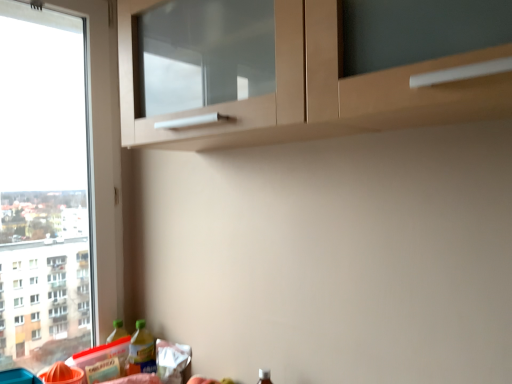
Question: From the image's perspective, is translucent plastic bottle at lower left, which is counted as the first bottle, starting from the left, above or below translucent plastic bottle at lower left, the first bottle when ordered from right to left?

Choices:
 (A) below
 (B) above

Answer: (A)

Question: Is translucent plastic bottle at lower left, the second bottle viewed from the right, taller or shorter than translucent plastic bottle at lower left, the first bottle when ordered from right to left?

Choices:
 (A) short
 (B) tall

Answer: (B)

Question: From a real-world perspective, relative to translucent plastic bottle at lower left, arranged as the 2th bottle when viewed from the left, is translucent plastic bottle at lower left, which is counted as the first bottle, starting from the left, vertically above or below?

Choices:
 (A) above
 (B) below

Answer: (A)

Question: From a real-world perspective, is translucent plastic bottle at lower left, the first bottle when ordered from right to left, physically located above or below translucent plastic bottle at lower left, the second bottle viewed from the right?

Choices:
 (A) above
 (B) below

Answer: (B)

Question: Relative to translucent plastic bottle at lower left, the second bottle viewed from the right, is translucent plastic bottle at lower left, the first bottle when ordered from right to left, in front or behind?

Choices:
 (A) front
 (B) behind

Answer: (A)

Question: Is translucent plastic bottle at lower left, arranged as the 2th bottle when viewed from the left, spatially inside translucent plastic bottle at lower left, the second bottle viewed from the right, or outside of it?

Choices:
 (A) inside
 (B) outside

Answer: (B)

Question: From the image's perspective, is translucent plastic bottle at lower left, the first bottle when ordered from right to left, positioned above or below translucent plastic bottle at lower left, the second bottle viewed from the right?

Choices:
 (A) above
 (B) below

Answer: (A)